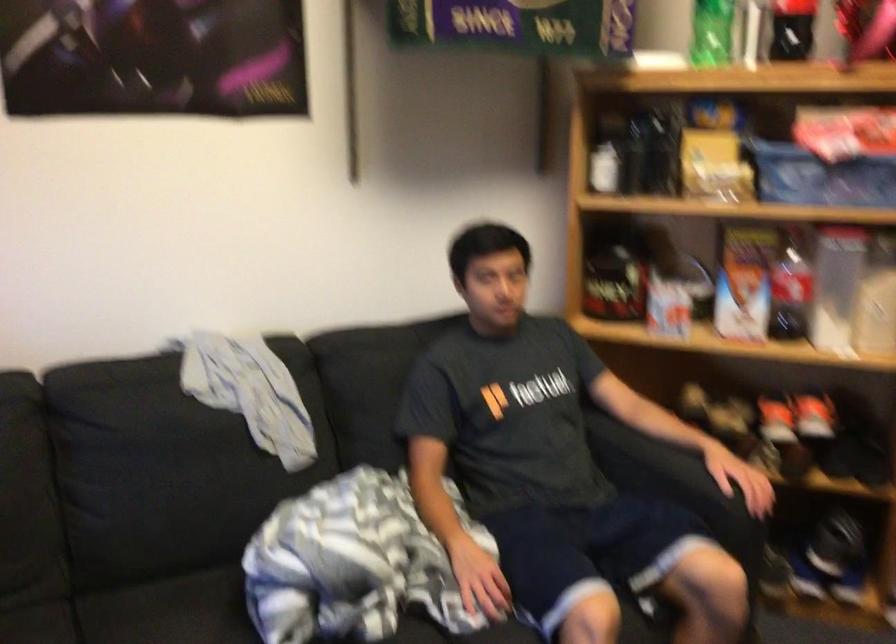
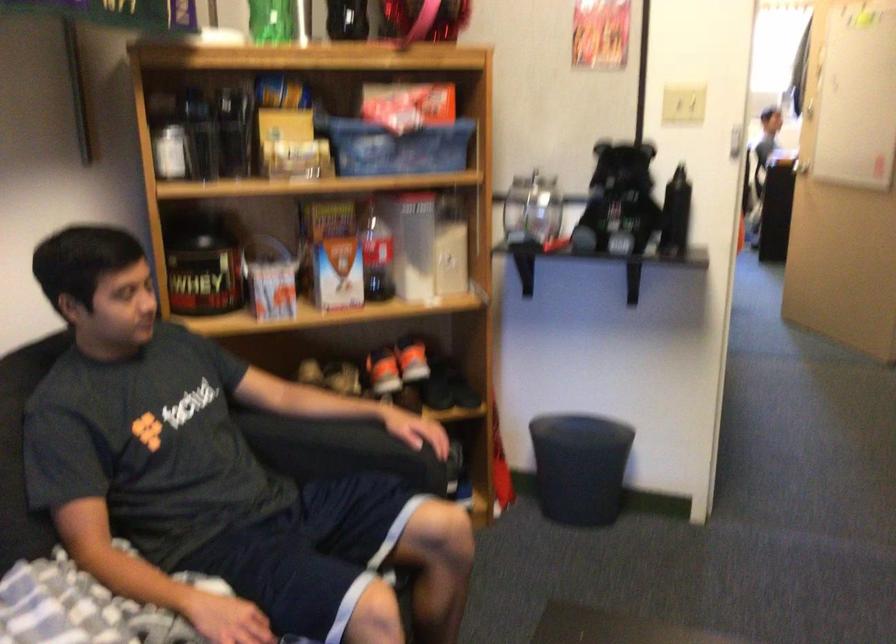
Find the pixel in the second image that matches the point at 808,406 in the first image.

(411, 359)